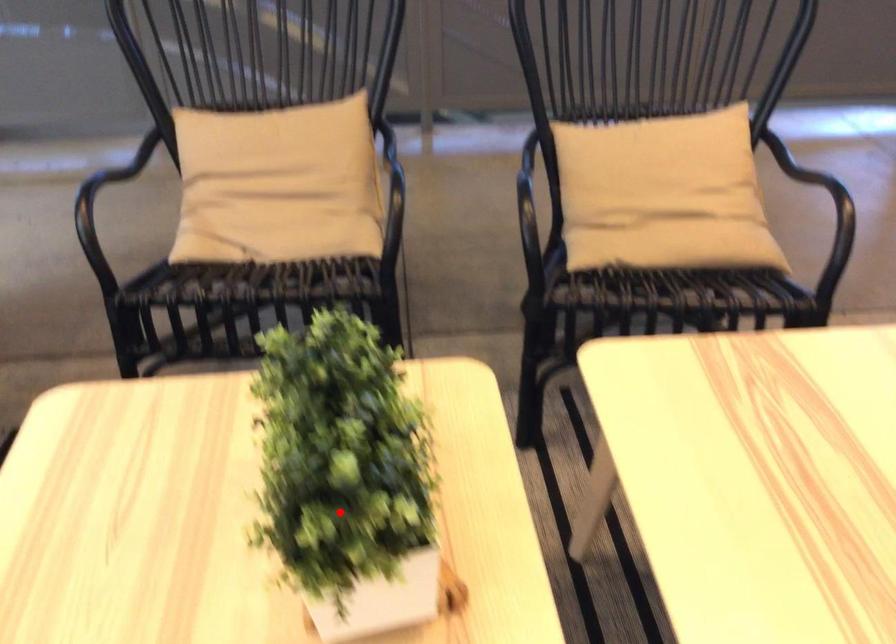
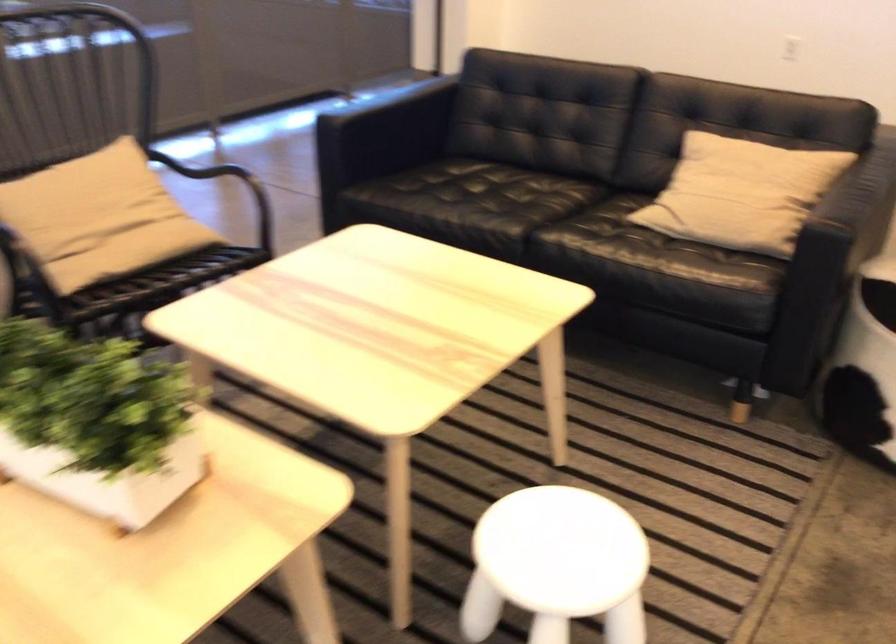
Question: A red point is marked in image1. In image2, is the corresponding 3D point closer to the camera or farther? Reply with the corresponding letter.

Choices:
 (A) The corresponding 3D point is closer.
 (B) The corresponding 3D point is farther.

Answer: (B)